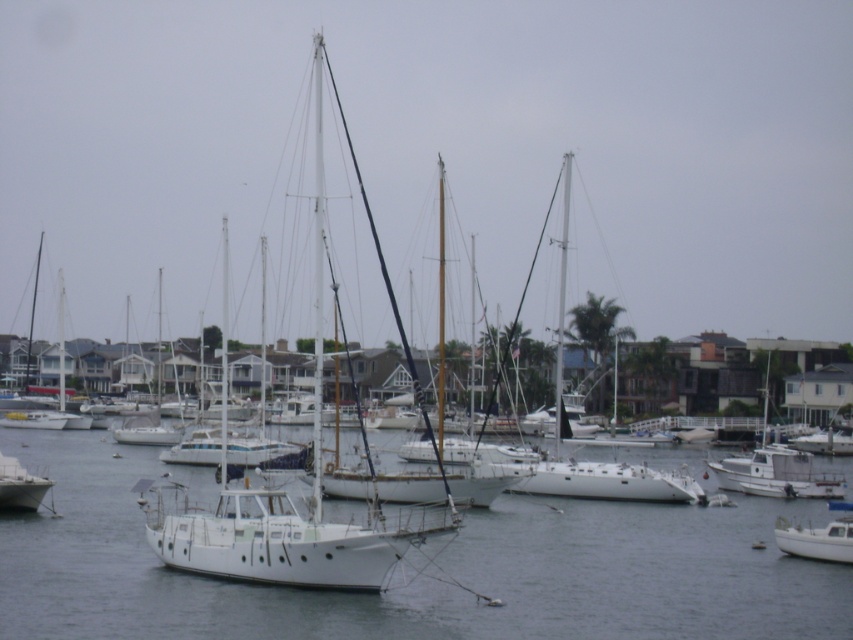
Is white matte water at center taller than white matte boat at center?

No, white matte water at center is not taller than white matte boat at center.

Find the location of `white matte water at center`. white matte water at center is located at coordinates (421, 576).

Identify the location of white matte water at center. This screenshot has height=640, width=853. (421, 576).

Is white matte boat at center to the left of white matte sailboat at lower left from the viewer's perspective?

Incorrect, white matte boat at center is not on the left side of white matte sailboat at lower left.

Is white matte boat at center positioned in front of white matte sailboat at lower left?

No.

Where is `white matte boat at center`? white matte boat at center is located at coordinates (776, 472).

Is white matte water at center taller than white matte boat at lower right?

Yes.

Can you confirm if white matte water at center is positioned to the left of white matte boat at lower right?

Indeed, white matte water at center is positioned on the left side of white matte boat at lower right.

Is point (12, 547) closer to camera compared to point (822, 552)?

That is True.

Where is `white matte water at center`? white matte water at center is located at coordinates (421, 576).